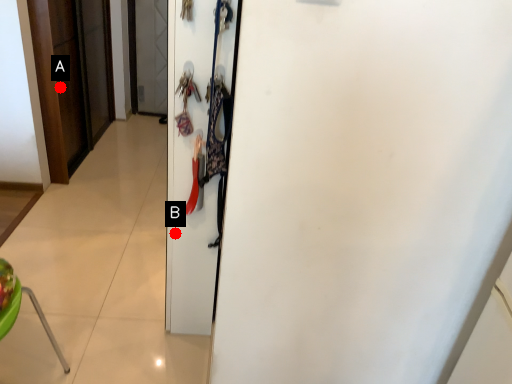
Question: Two points are circled on the image, labeled by A and B beside each circle. Which point is farther from the camera taking this photo?

Choices:
 (A) A is further
 (B) B is further

Answer: (A)